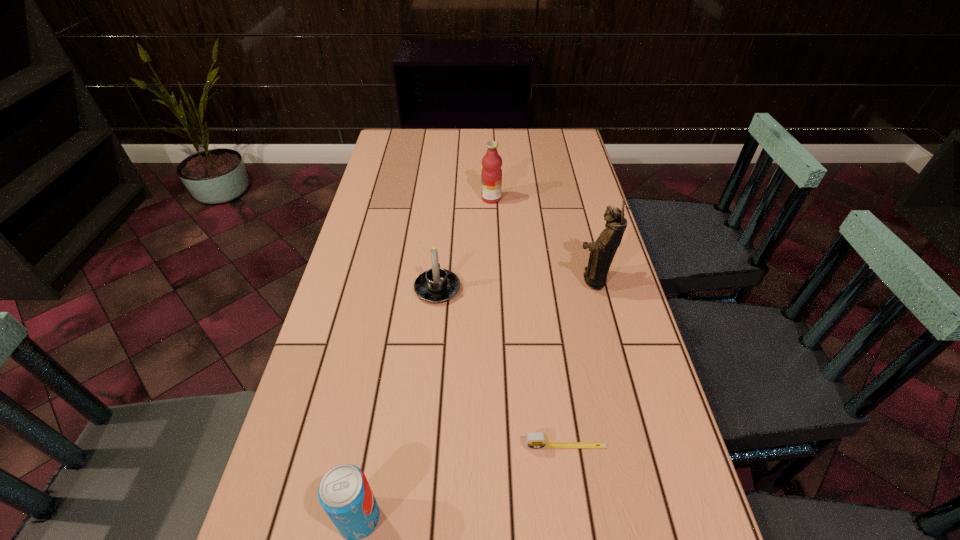
The width and height of the screenshot is (960, 540). I want to click on vacant area between the second tallest object and the second object from right to left, so click(x=528, y=322).

Identify the location of object that is the second closest to the candle holder. The height and width of the screenshot is (540, 960). (491, 175).

Locate which object is the third closest to the third object from right to left. Please provide its 2D coordinates. Your answer should be formatted as a tuple, i.e. [(x, y)], where the tuple contains the x and y coordinates of a point satisfying the conditions above.

[(537, 440)]